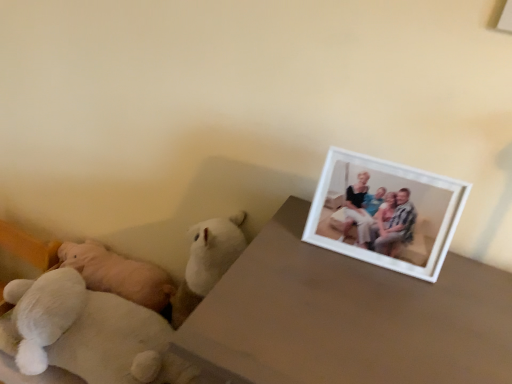
Find the location of `white plush teddy bear at lower left, the second teddy bear positioned from the back`. white plush teddy bear at lower left, the second teddy bear positioned from the back is located at coordinates (89, 333).

You are a GUI agent. You are given a task and a screenshot of the screen. Output one action in this format:
    pyautogui.click(x=<x>, y=<y>)
    Task: Click on the white plush teddy bear at left, which appears as the second teddy bear when viewed from the right
    Image resolution: width=512 pixels, height=384 pixels.
    Given the screenshot: What is the action you would take?
    pyautogui.click(x=44, y=313)

Does white matte picture frame at upper right have a smaller size compared to white matte table at upper right?

Yes.

Considering the relative sizes of white matte picture frame at upper right and white matte table at upper right in the image provided, is white matte picture frame at upper right wider than white matte table at upper right?

No.

Consider the image. Which is correct: white matte picture frame at upper right is inside white matte table at upper right, or outside of it?

white matte picture frame at upper right is not enclosed by white matte table at upper right.

Is point (314, 219) closer or farther from the camera than point (452, 290)?

Clearly, point (314, 219) is more distant from the camera than point (452, 290).

Considering the relative sizes of white plush teddy bear at left, which appears as the second teddy bear when viewed from the right, and white matte table at upper right in the image provided, is white plush teddy bear at left, which appears as the second teddy bear when viewed from the right, taller than white matte table at upper right?

Incorrect, the height of white plush teddy bear at left, which appears as the second teddy bear when viewed from the right, is not larger of that of white matte table at upper right.

Is white plush teddy bear at left, which ranks as the 1th teddy bear in left-to-right order, aimed at white matte table at upper right?

No, white plush teddy bear at left, which ranks as the 1th teddy bear in left-to-right order, is not facing towards white matte table at upper right.

Does white plush teddy bear at left, the 2th teddy bear positioned from the front, have a greater width compared to white matte table at upper right?

Incorrect, the width of white plush teddy bear at left, the 2th teddy bear positioned from the front, does not surpass that of white matte table at upper right.

Is point (39, 341) more distant than point (298, 274)?

Yes, it is behind point (298, 274).

Can you tell me how much white matte table at upper right and white plush teddy bear at lower left, which is the 2th teddy bear in left-to-right order, differ in facing direction?

0.836 degrees.

Between white matte table at upper right and white plush teddy bear at lower left, the second teddy bear positioned from the back, which one has more height?

white matte table at upper right.

Would you say white matte table at upper right is to the left or to the right of white plush teddy bear at lower left, the first teddy bear viewed from the front, in the picture?

white matte table at upper right is to the right of white plush teddy bear at lower left, the first teddy bear viewed from the front.

From the image's perspective, is white matte picture frame at upper right over white plush teddy bear at left, which ranks as the 1th teddy bear in left-to-right order?

Yes.

Based on the photo, how distant is white matte picture frame at upper right from white plush teddy bear at left, which ranks as the 1th teddy bear in left-to-right order?

The distance of white matte picture frame at upper right from white plush teddy bear at left, which ranks as the 1th teddy bear in left-to-right order, is 29.20 inches.

Is white plush teddy bear at left, which ranks as the 1th teddy bear in left-to-right order, completely or partially inside white matte picture frame at upper right?

No, white plush teddy bear at left, which ranks as the 1th teddy bear in left-to-right order, is not surrounded by white matte picture frame at upper right.

The image size is (512, 384). Identify the location of the 2nd teddy bear behind the white matte picture frame at upper right, counting from the anchor's position. (44, 313).

Could white plush teddy bear at lower left, which is the 2th teddy bear in left-to-right order, be considered to be inside white plush teddy bear at left, marked as the first teddy bear in a back-to-front arrangement?

No, white plush teddy bear at lower left, which is the 2th teddy bear in left-to-right order, is not surrounded by white plush teddy bear at left, marked as the first teddy bear in a back-to-front arrangement.

From the image's perspective, does white plush teddy bear at left, which appears as the second teddy bear when viewed from the right, appear lower than white plush teddy bear at lower left, the second teddy bear positioned from the back?

Actually, white plush teddy bear at left, which appears as the second teddy bear when viewed from the right, appears above white plush teddy bear at lower left, the second teddy bear positioned from the back, in the image.

Considering the sizes of objects white plush teddy bear at left, the 2th teddy bear positioned from the front, and white plush teddy bear at lower left, the second teddy bear positioned from the back, in the image provided, who is shorter, white plush teddy bear at left, the 2th teddy bear positioned from the front, or white plush teddy bear at lower left, the second teddy bear positioned from the back,?

Standing shorter between the two is white plush teddy bear at lower left, the second teddy bear positioned from the back.

Is white plush teddy bear at left, which appears as the second teddy bear when viewed from the right, in front of or behind white plush teddy bear at lower left, the first teddy bear viewed from the front, in the image?

Visually, white plush teddy bear at left, which appears as the second teddy bear when viewed from the right, is located behind white plush teddy bear at lower left, the first teddy bear viewed from the front.

From the image's perspective, who appears lower, white matte table at upper right or white plush teddy bear at left, marked as the first teddy bear in a back-to-front arrangement?

From the image's view, white matte table at upper right is below.

Would you say white matte table at upper right contains white plush teddy bear at left, marked as the first teddy bear in a back-to-front arrangement?

Actually, white plush teddy bear at left, marked as the first teddy bear in a back-to-front arrangement, is outside white matte table at upper right.

Based on the photo, which is nearer, (256, 272) or (42, 308)?

The point (256, 272) is in front.

Can you confirm if white plush teddy bear at lower left, which is the 2th teddy bear in left-to-right order, is positioned to the left of white matte table at upper right?

Yes, white plush teddy bear at lower left, which is the 2th teddy bear in left-to-right order, is to the left of white matte table at upper right.

Is white matte table at upper right located within white plush teddy bear at lower left, the second teddy bear positioned from the back?

No, white matte table at upper right is located outside of white plush teddy bear at lower left, the second teddy bear positioned from the back.

Is white plush teddy bear at lower left, the first teddy bear viewed from the front, positioned with its back to white matte table at upper right?

white plush teddy bear at lower left, the first teddy bear viewed from the front, is not turned away from white matte table at upper right.

From a real-world perspective, is white plush teddy bear at lower left, the first teddy bear when ordered from right to left, beneath white matte table at upper right?

Yes.

The image size is (512, 384). I want to click on table in front of the white matte picture frame at upper right, so click(347, 317).

Where is `teddy bear that is the 2nd one when counting upward from the white matte table at upper right (from the image's perspective)`? The height and width of the screenshot is (384, 512). teddy bear that is the 2nd one when counting upward from the white matte table at upper right (from the image's perspective) is located at coordinates (44, 313).

When comparing their distances from white plush teddy bear at lower left, which is the 2th teddy bear in left-to-right order, does white matte table at upper right or white matte picture frame at upper right seem closer?

The object closer to white plush teddy bear at lower left, which is the 2th teddy bear in left-to-right order, is white matte table at upper right.

From the image, which object appears to be nearer to white matte table at upper right, white plush teddy bear at left, marked as the first teddy bear in a back-to-front arrangement, or white plush teddy bear at lower left, the first teddy bear when ordered from right to left?

Among the two, white plush teddy bear at lower left, the first teddy bear when ordered from right to left, is located nearer to white matte table at upper right.

Looking at the image, which one is located further to white plush teddy bear at lower left, the first teddy bear viewed from the front, white matte picture frame at upper right or white plush teddy bear at left, which ranks as the 1th teddy bear in left-to-right order?

white matte picture frame at upper right is positioned further to the anchor white plush teddy bear at lower left, the first teddy bear viewed from the front.

From the image, which object appears to be farther from white matte table at upper right, white matte picture frame at upper right or white plush teddy bear at lower left, the first teddy bear viewed from the front?

white plush teddy bear at lower left, the first teddy bear viewed from the front, lies further to white matte table at upper right than the other object.

Looking at the image, which one is located closer to white plush teddy bear at left, marked as the first teddy bear in a back-to-front arrangement, white matte picture frame at upper right or white matte table at upper right?

white matte table at upper right.

Estimate the real-world distances between objects in this image. Which object is further from white plush teddy bear at left, which appears as the second teddy bear when viewed from the right, white matte picture frame at upper right or white plush teddy bear at lower left, which is the 2th teddy bear in left-to-right order?

Among the two, white matte picture frame at upper right is located further to white plush teddy bear at left, which appears as the second teddy bear when viewed from the right.

When comparing their distances from white plush teddy bear at left, the 2th teddy bear positioned from the front, does white matte table at upper right or white plush teddy bear at lower left, the second teddy bear positioned from the back, seem closer?

white plush teddy bear at lower left, the second teddy bear positioned from the back, lies closer to white plush teddy bear at left, the 2th teddy bear positioned from the front, than the other object.

Estimate the real-world distances between objects in this image. Which object is further from white matte table at upper right, white matte picture frame at upper right or white plush teddy bear at left, which ranks as the 1th teddy bear in left-to-right order?

white plush teddy bear at left, which ranks as the 1th teddy bear in left-to-right order, is further to white matte table at upper right.

Identify the location of table between white plush teddy bear at left, which appears as the second teddy bear when viewed from the right, and white matte picture frame at upper right, in the horizontal direction. This screenshot has height=384, width=512. (347, 317).

Where is `teddy bear situated between white plush teddy bear at left, which appears as the second teddy bear when viewed from the right, and white matte picture frame at upper right from left to right`? This screenshot has width=512, height=384. teddy bear situated between white plush teddy bear at left, which appears as the second teddy bear when viewed from the right, and white matte picture frame at upper right from left to right is located at coordinates (89, 333).

This screenshot has height=384, width=512. I want to click on teddy bear located between white plush teddy bear at left, which ranks as the 1th teddy bear in left-to-right order, and white matte table at upper right in the left-right direction, so click(89, 333).

Locate an element on the screen. Image resolution: width=512 pixels, height=384 pixels. table situated between white plush teddy bear at lower left, the second teddy bear positioned from the back, and white matte picture frame at upper right from left to right is located at coordinates (347, 317).